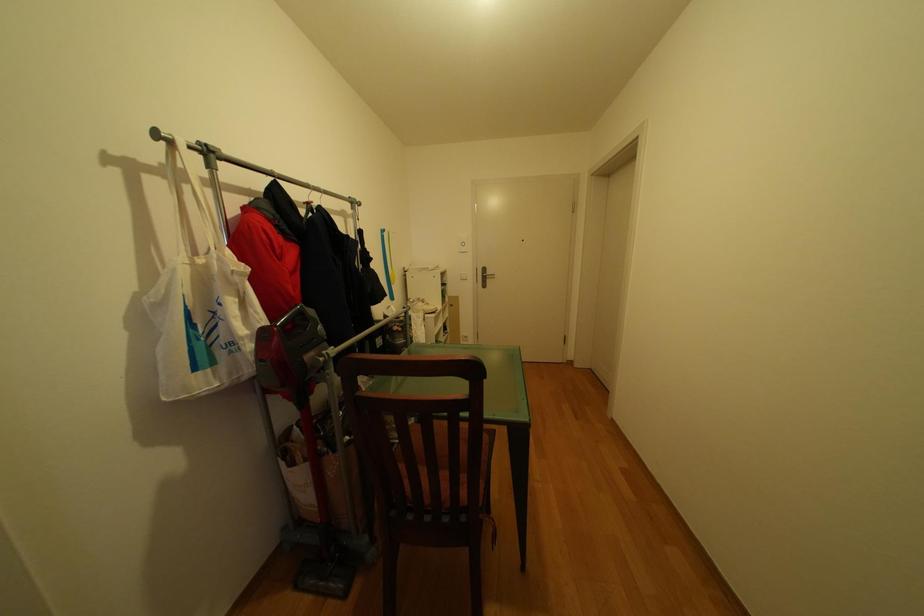
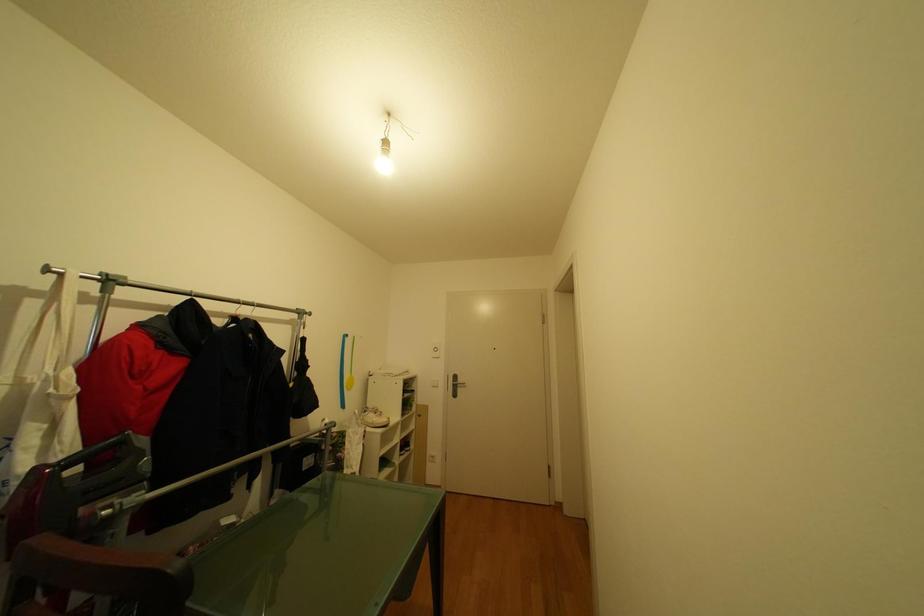
Question: Based on the continuous images, in which direction is the camera rotating? Reply with the corresponding letter.

Choices:
 (A) Left
 (B) Right
 (C) Up
 (D) Down

Answer: (C)